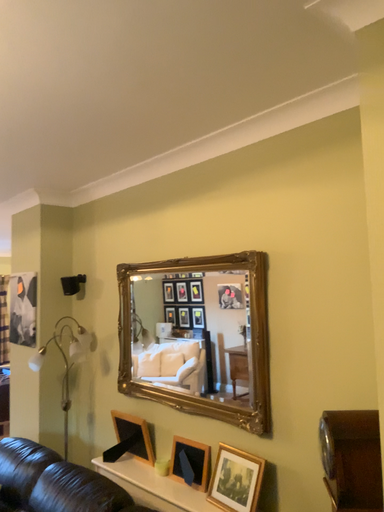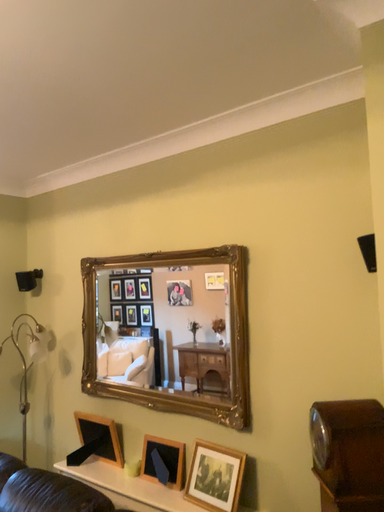
Question: How did the camera likely rotate when shooting the video?

Choices:
 (A) rotated left
 (B) rotated right

Answer: (B)